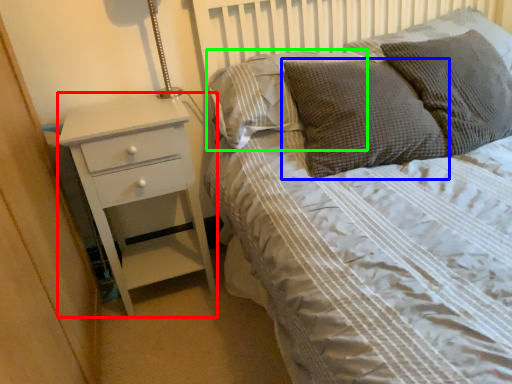
Question: Which is farther away from chest of drawers (highlighted by a red box)? pillow (highlighted by a blue box) or pillow (highlighted by a green box)?

Choices:
 (A) pillow
 (B) pillow

Answer: (A)